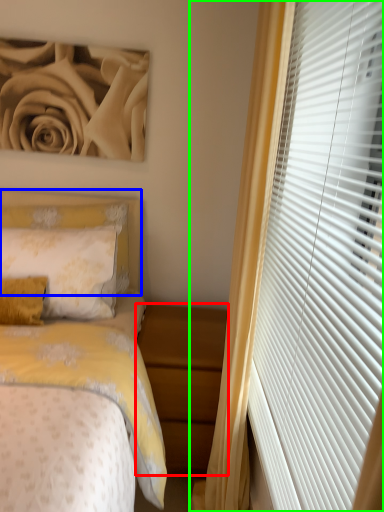
Question: Which object is positioned closest to nightstand (highlighted by a red box)? Select from headboard (highlighted by a blue box) and curtain (highlighted by a green box).

Choices:
 (A) headboard
 (B) curtain

Answer: (B)